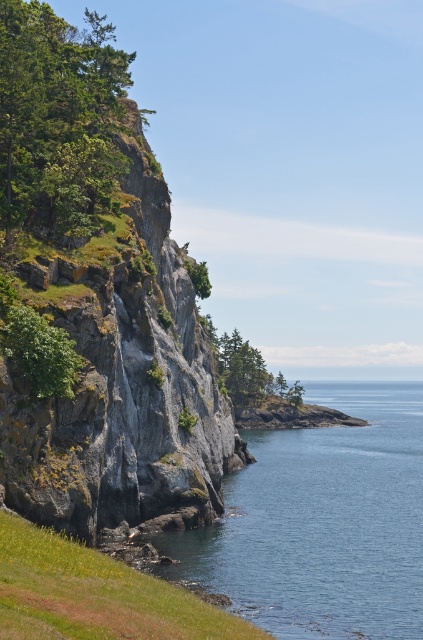
Describe the element at coordinates (321, 522) in the screenshot. I see `clear blue water at center` at that location.

Between point (332, 428) and point (52, 566), which one is positioned in front?

Point (52, 566)

Locate an element on the screen. This screenshot has height=640, width=423. clear blue water at center is located at coordinates (321, 522).

Does green rough rock at left have a lesser width compared to green leafy tree at lower left?

In fact, green rough rock at left might be wider than green leafy tree at lower left.

The height and width of the screenshot is (640, 423). What do you see at coordinates (57, 115) in the screenshot?
I see `green rough rock at left` at bounding box center [57, 115].

Locate an element on the screen. This screenshot has width=423, height=640. green rough rock at left is located at coordinates (57, 115).

Does clear blue water at center have a smaller size compared to green leafy tree at lower left?

Actually, clear blue water at center might be larger than green leafy tree at lower left.

Is point (412, 605) positioned behind point (43, 337)?

No, (412, 605) is closer to viewer.

The height and width of the screenshot is (640, 423). What are the coordinates of `clear blue water at center` in the screenshot? It's located at (321, 522).